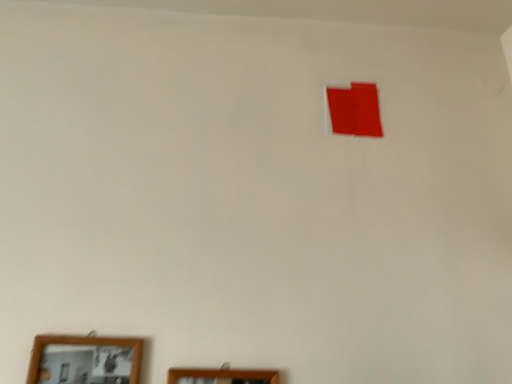
What do you see at coordinates (85, 360) in the screenshot? This screenshot has width=512, height=384. I see `wooden framed mirror at lower left, acting as the 2th picture frame starting from the right` at bounding box center [85, 360].

Image resolution: width=512 pixels, height=384 pixels. What are the coordinates of `wooden framed mirror at lower left, acting as the 2th picture frame starting from the right` in the screenshot? It's located at (85, 360).

The height and width of the screenshot is (384, 512). I want to click on wooden picture frame at lower center, which is the 1th picture frame from right to left, so click(x=222, y=376).

This screenshot has width=512, height=384. What do you see at coordinates (222, 376) in the screenshot?
I see `wooden picture frame at lower center, positioned as the second picture frame in left-to-right order` at bounding box center [222, 376].

Locate an element on the screen. Image resolution: width=512 pixels, height=384 pixels. wooden framed mirror at lower left, acting as the 2th picture frame starting from the right is located at coordinates (85, 360).

Is wooden picture frame at lower center, positioned as the second picture frame in left-to-right order, to the right of wooden framed mirror at lower left, acting as the 2th picture frame starting from the right, from the viewer's perspective?

Correct, you'll find wooden picture frame at lower center, positioned as the second picture frame in left-to-right order, to the right of wooden framed mirror at lower left, acting as the 2th picture frame starting from the right.

Between wooden picture frame at lower center, positioned as the second picture frame in left-to-right order, and wooden framed mirror at lower left, which is the first picture frame from left to right, which one is positioned behind?

wooden picture frame at lower center, positioned as the second picture frame in left-to-right order.

Is point (252, 378) closer or farther from the camera than point (59, 341)?

Point (252, 378) is positioned closer to the camera compared to point (59, 341).

From the image's perspective, which one is positioned lower, wooden picture frame at lower center, which is the 1th picture frame from right to left, or wooden framed mirror at lower left, acting as the 2th picture frame starting from the right?

wooden picture frame at lower center, which is the 1th picture frame from right to left, from the image's perspective.

Consider the image. From a real-world perspective, which object rests below the other?

wooden picture frame at lower center, which is the 1th picture frame from right to left, from a real-world perspective.

Between wooden picture frame at lower center, which is the 1th picture frame from right to left, and wooden framed mirror at lower left, which is the first picture frame from left to right, which one has smaller width?

Thinner between the two is wooden picture frame at lower center, which is the 1th picture frame from right to left.

Based on the photo, between wooden picture frame at lower center, which is the 1th picture frame from right to left, and wooden framed mirror at lower left, which is the first picture frame from left to right, which one has more height?

wooden framed mirror at lower left, which is the first picture frame from left to right, is taller.

Considering the relative sizes of wooden picture frame at lower center, which is the 1th picture frame from right to left, and wooden framed mirror at lower left, acting as the 2th picture frame starting from the right, in the image provided, is wooden picture frame at lower center, which is the 1th picture frame from right to left, smaller than wooden framed mirror at lower left, acting as the 2th picture frame starting from the right,?

Yes.

Is wooden picture frame at lower center, which is the 1th picture frame from right to left, surrounding wooden framed mirror at lower left, which is the first picture frame from left to right?

No, wooden framed mirror at lower left, which is the first picture frame from left to right, is located outside of wooden picture frame at lower center, which is the 1th picture frame from right to left.

Would you say wooden picture frame at lower center, which is the 1th picture frame from right to left, is a long distance from wooden framed mirror at lower left, acting as the 2th picture frame starting from the right?

wooden picture frame at lower center, which is the 1th picture frame from right to left, is near wooden framed mirror at lower left, acting as the 2th picture frame starting from the right, not far away.

Is wooden picture frame at lower center, positioned as the second picture frame in left-to-right order, oriented away from wooden framed mirror at lower left, acting as the 2th picture frame starting from the right?

That's not correct — wooden picture frame at lower center, positioned as the second picture frame in left-to-right order, is not looking away from wooden framed mirror at lower left, acting as the 2th picture frame starting from the right.

How many degrees apart are the facing directions of wooden picture frame at lower center, positioned as the second picture frame in left-to-right order, and wooden framed mirror at lower left, acting as the 2th picture frame starting from the right?

The angle between the facing direction of wooden picture frame at lower center, positioned as the second picture frame in left-to-right order, and the facing direction of wooden framed mirror at lower left, acting as the 2th picture frame starting from the right, is 2.09 degrees.

Could you measure the distance between wooden picture frame at lower center, positioned as the second picture frame in left-to-right order, and wooden framed mirror at lower left, which is the first picture frame from left to right?

wooden picture frame at lower center, positioned as the second picture frame in left-to-right order, and wooden framed mirror at lower left, which is the first picture frame from left to right, are 19.49 centimeters apart from each other.

I want to click on picture frame above the wooden picture frame at lower center, positioned as the second picture frame in left-to-right order (from a real-world perspective), so click(85, 360).

Considering the relative positions of wooden framed mirror at lower left, which is the first picture frame from left to right, and wooden picture frame at lower center, which is the 1th picture frame from right to left, in the image provided, is wooden framed mirror at lower left, which is the first picture frame from left to right, to the left or to the right of wooden picture frame at lower center, which is the 1th picture frame from right to left,?

Clearly, wooden framed mirror at lower left, which is the first picture frame from left to right, is on the left of wooden picture frame at lower center, which is the 1th picture frame from right to left, in the image.

Is wooden framed mirror at lower left, acting as the 2th picture frame starting from the right, positioned behind wooden picture frame at lower center, positioned as the second picture frame in left-to-right order?

No, it is in front of wooden picture frame at lower center, positioned as the second picture frame in left-to-right order.

Is point (137, 351) in front of point (224, 379)?

No.

From the image's perspective, would you say wooden framed mirror at lower left, which is the first picture frame from left to right, is positioned over wooden picture frame at lower center, which is the 1th picture frame from right to left?

Yes, from the image's perspective, wooden framed mirror at lower left, which is the first picture frame from left to right, is on top of wooden picture frame at lower center, which is the 1th picture frame from right to left.

From a real-world perspective, is wooden framed mirror at lower left, which is the first picture frame from left to right, physically above wooden picture frame at lower center, which is the 1th picture frame from right to left?

Correct, in the physical world, wooden framed mirror at lower left, which is the first picture frame from left to right, is higher than wooden picture frame at lower center, which is the 1th picture frame from right to left.

Is wooden framed mirror at lower left, acting as the 2th picture frame starting from the right, wider than wooden picture frame at lower center, positioned as the second picture frame in left-to-right order?

Yes.

Is wooden framed mirror at lower left, acting as the 2th picture frame starting from the right, taller than wooden picture frame at lower center, positioned as the second picture frame in left-to-right order?

Yes.

Which of these two, wooden framed mirror at lower left, acting as the 2th picture frame starting from the right, or wooden picture frame at lower center, positioned as the second picture frame in left-to-right order, is smaller?

wooden picture frame at lower center, positioned as the second picture frame in left-to-right order.

Do you think wooden framed mirror at lower left, acting as the 2th picture frame starting from the right, is within wooden picture frame at lower center, positioned as the second picture frame in left-to-right order, or outside of it?

wooden framed mirror at lower left, acting as the 2th picture frame starting from the right, is not inside wooden picture frame at lower center, positioned as the second picture frame in left-to-right order, it's outside.

Is wooden framed mirror at lower left, which is the first picture frame from left to right, next to wooden picture frame at lower center, positioned as the second picture frame in left-to-right order, and touching it?

No.

Is wooden framed mirror at lower left, acting as the 2th picture frame starting from the right, turned away from wooden picture frame at lower center, which is the 1th picture frame from right to left?

wooden framed mirror at lower left, acting as the 2th picture frame starting from the right, is not turned away from wooden picture frame at lower center, which is the 1th picture frame from right to left.

Locate an element on the screen. This screenshot has height=384, width=512. picture frame located on the right of wooden framed mirror at lower left, acting as the 2th picture frame starting from the right is located at coordinates (222, 376).

Locate an element on the screen. picture frame in front of the wooden picture frame at lower center, which is the 1th picture frame from right to left is located at coordinates (85, 360).

This screenshot has width=512, height=384. I want to click on picture frame lying above the wooden picture frame at lower center, positioned as the second picture frame in left-to-right order (from the image's perspective), so click(x=85, y=360).